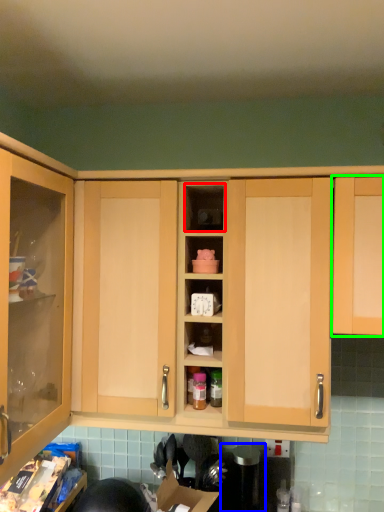
Question: Which object is positioned closest to cabinet (highlighted by a red box)? Select from appliance (highlighted by a blue box) and cabinetry (highlighted by a green box).

Choices:
 (A) appliance
 (B) cabinetry

Answer: (B)